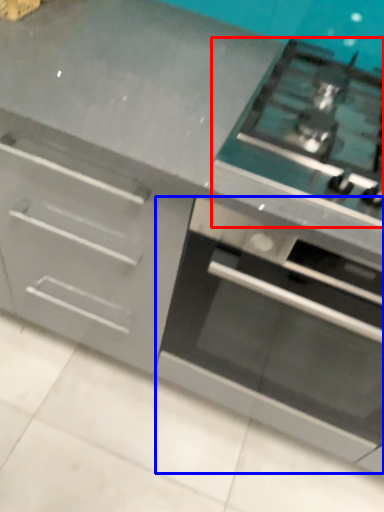
Question: Which point is further to the camera, gas stove (highlighted by a red box) or oven (highlighted by a blue box)?

Choices:
 (A) gas stove
 (B) oven

Answer: (A)